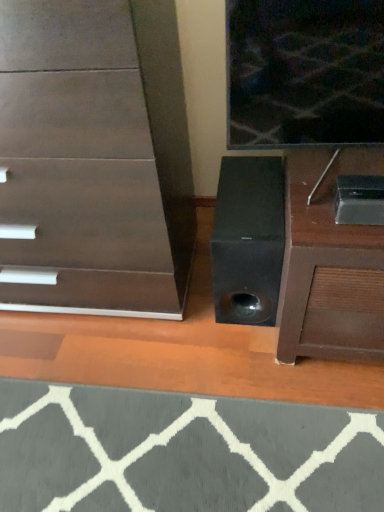
The width and height of the screenshot is (384, 512). I want to click on blank space above gray woolen doormat at lower center (from a real-world perspective), so click(161, 449).